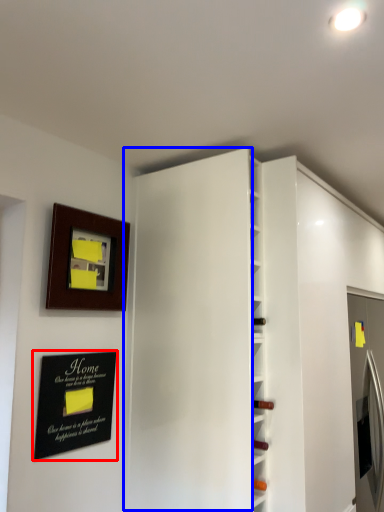
Question: Which object appears farthest to the camera in this image, plaque (highlighted by a red box) or door (highlighted by a blue box)?

Choices:
 (A) plaque
 (B) door

Answer: (A)